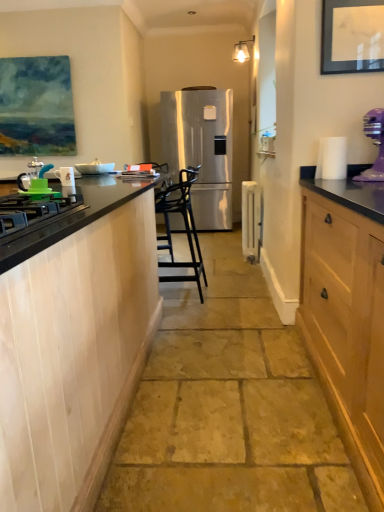
Question: Does white metallic radiator at center, positioned as the first appliance in right-to-left order, have a lesser width compared to black metal bar stool at center?

Choices:
 (A) no
 (B) yes

Answer: (B)

Question: Is black metal bar stool at center at the back of white metallic radiator at center, the first appliance from the back?

Choices:
 (A) yes
 (B) no

Answer: (B)

Question: From a real-world perspective, is white metallic radiator at center, which is the fourth appliance in left-to-right order, on top of black metal bar stool at center?

Choices:
 (A) yes
 (B) no

Answer: (B)

Question: Is white metallic radiator at center, placed as the 4th appliance when sorted from front to back, shorter than black metal bar stool at center?

Choices:
 (A) no
 (B) yes

Answer: (B)

Question: Does white metallic radiator at center, which is the fourth appliance in left-to-right order, contain black metal bar stool at center?

Choices:
 (A) no
 (B) yes

Answer: (A)

Question: Does white metallic radiator at center, positioned as the first appliance in right-to-left order, appear on the left side of black metal bar stool at center?

Choices:
 (A) yes
 (B) no

Answer: (B)

Question: Does black metal bar stool at center appear on the right side of matte black picture frame at upper right?

Choices:
 (A) yes
 (B) no

Answer: (B)

Question: Is black metal bar stool at center touching matte black picture frame at upper right?

Choices:
 (A) yes
 (B) no

Answer: (B)

Question: Does black metal bar stool at center have a larger size compared to matte black picture frame at upper right?

Choices:
 (A) yes
 (B) no

Answer: (A)

Question: Is black metal bar stool at center to the left of matte black picture frame at upper right from the viewer's perspective?

Choices:
 (A) no
 (B) yes

Answer: (B)

Question: Can you confirm if black metal bar stool at center is taller than matte black picture frame at upper right?

Choices:
 (A) yes
 (B) no

Answer: (A)

Question: Can you confirm if black metal bar stool at center is shorter than matte black picture frame at upper right?

Choices:
 (A) yes
 (B) no

Answer: (B)

Question: Is satin silver refrigerator at center positioned with its back to black matte gas stove at left?

Choices:
 (A) no
 (B) yes

Answer: (A)